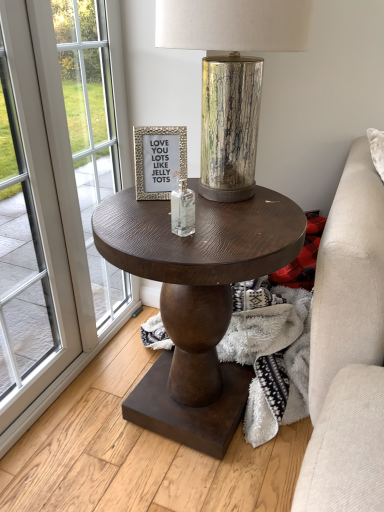
Identify the location of unoccupied region to the right of clear glass bottle at center. (243, 226).